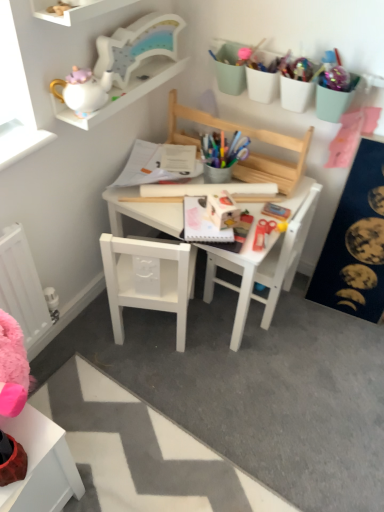
Question: Would you say white matte chair at lower left, placed as the 2th chair when sorted from right to left, is inside or outside white wooden table at center?

Choices:
 (A) inside
 (B) outside

Answer: (A)

Question: Based on their sizes in the image, would you say white matte chair at lower left, placed as the 2th chair when sorted from right to left, is bigger or smaller than white wooden table at center?

Choices:
 (A) small
 (B) big

Answer: (A)

Question: Which object is positioned closest to the white glossy teapot at upper left, the first shelf positioned from the back?

Choices:
 (A) white wooden table at center
 (B) white wooden chair at center, which is the second chair from left to right
 (C) white wooden shelf at upper left, which is the 1th shelf from front to back
 (D) dark blue fabric bulletin board at right
 (E) white matte chair at lower left, the 1th chair from the left

Answer: (C)

Question: Estimate the real-world distances between objects in this image. Which object is closer to the pastel green plastic containers at upper right, the 1th stationery from the back?

Choices:
 (A) white wooden shelf at upper left, placed as the second shelf when sorted from back to front
 (B) white wooden chair at center, arranged as the 1th chair when viewed from the right
 (C) white glossy teapot at upper left, the first stationery positioned from the front
 (D) dark blue fabric bulletin board at right
 (E) white matte chair at lower left, placed as the 2th chair when sorted from right to left

Answer: (D)